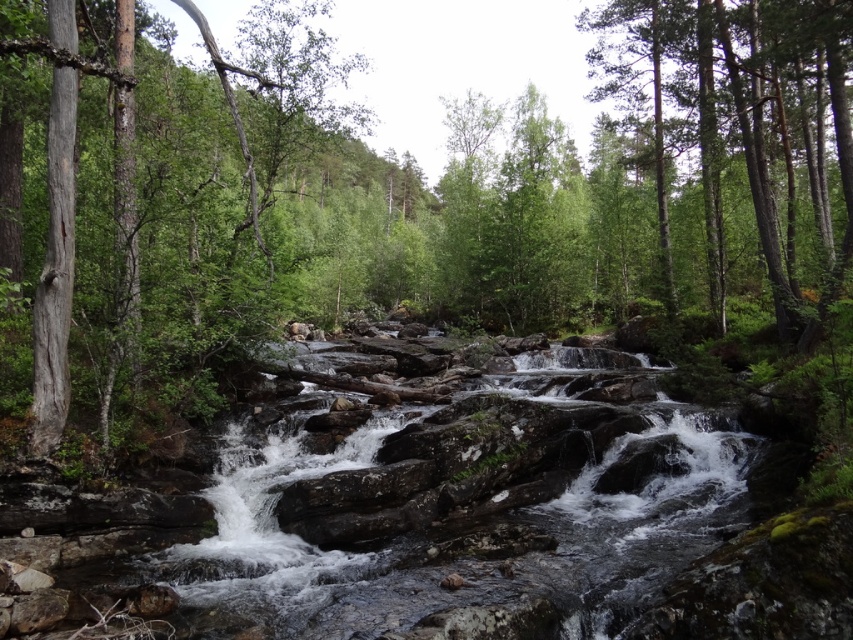
You are a hiker who wants to take a photo of the green leafy forest at center and the green smooth tree at upper right. Which one should you focus on first if you want to capture both in a single frame without moving your camera?

The green leafy forest at center is not as tall as the green smooth tree at upper right, so you should focus on the green smooth tree at upper right first to ensure it fits into the frame since it is taller.